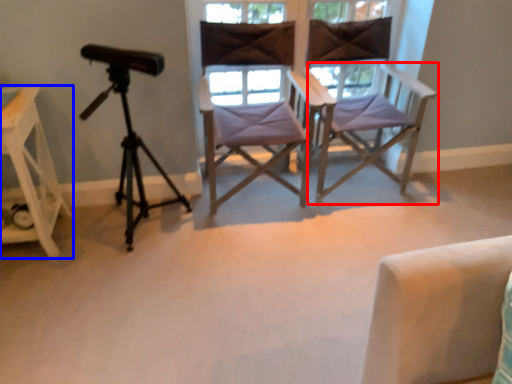
Question: Among these objects, which one is nearest to the camera, chair (highlighted by a red box) or furniture (highlighted by a blue box)?

Choices:
 (A) chair
 (B) furniture

Answer: (B)